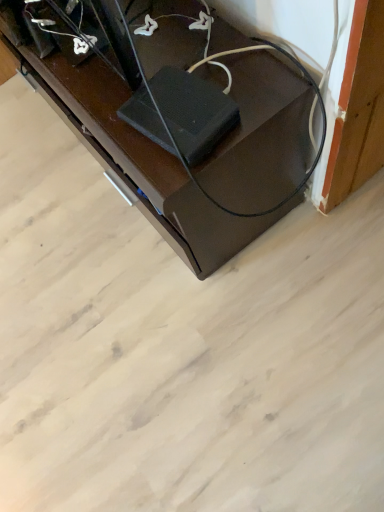
Locate an element on the screen. The image size is (384, 512). vacant space to the left of black rubber speaker at center is located at coordinates (122, 141).